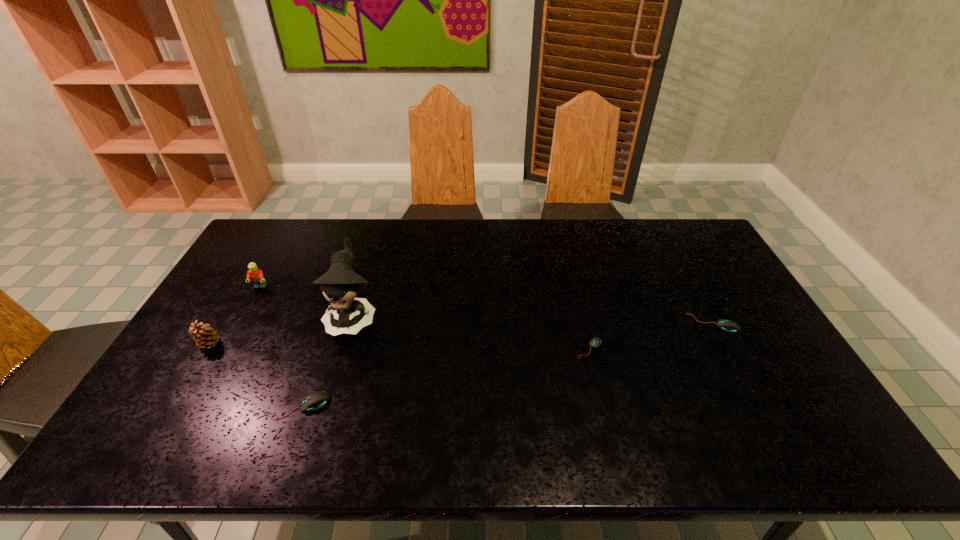
This screenshot has width=960, height=540. Find the location of `the nearest mouse`. the nearest mouse is located at coordinates (316, 400).

Where is `the nearest object`? This screenshot has height=540, width=960. the nearest object is located at coordinates (316, 400).

The image size is (960, 540). Identify the location of the fifth object from left to right. coord(596,341).

Image resolution: width=960 pixels, height=540 pixels. Identify the location of the shortest object. (596, 341).

The width and height of the screenshot is (960, 540). In order to click on the rightmost object in this screenshot , I will do `click(727, 325)`.

Where is `the fifth tallest object`? the fifth tallest object is located at coordinates (727, 325).

Where is `the farthest object`? This screenshot has height=540, width=960. the farthest object is located at coordinates (256, 275).

Where is `pinecone`? pinecone is located at coordinates (205, 337).

You are a GUI agent. You are given a task and a screenshot of the screen. Output one action in this format:
    pyautogui.click(x=<x>, y=<y>)
    Task: Click on the doll
    
    Given the screenshot: What is the action you would take?
    pyautogui.click(x=340, y=285)

I want to click on vacant region located on the left of the leftmost mouse, so coord(154,406).